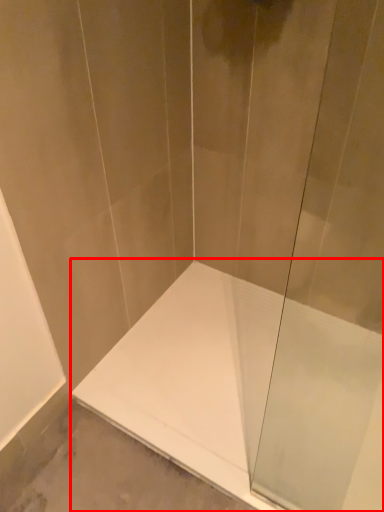
Question: From the image's perspective, what is the correct spatial relationship of bathtub (annotated by the red box) in relation to shower door?

Choices:
 (A) below
 (B) above

Answer: (A)